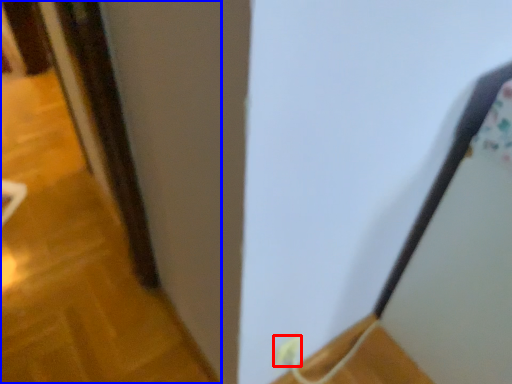
Question: Which point is closer to the camera, electric outlet (highlighted by a red box) or door (highlighted by a blue box)?

Choices:
 (A) electric outlet
 (B) door

Answer: (A)